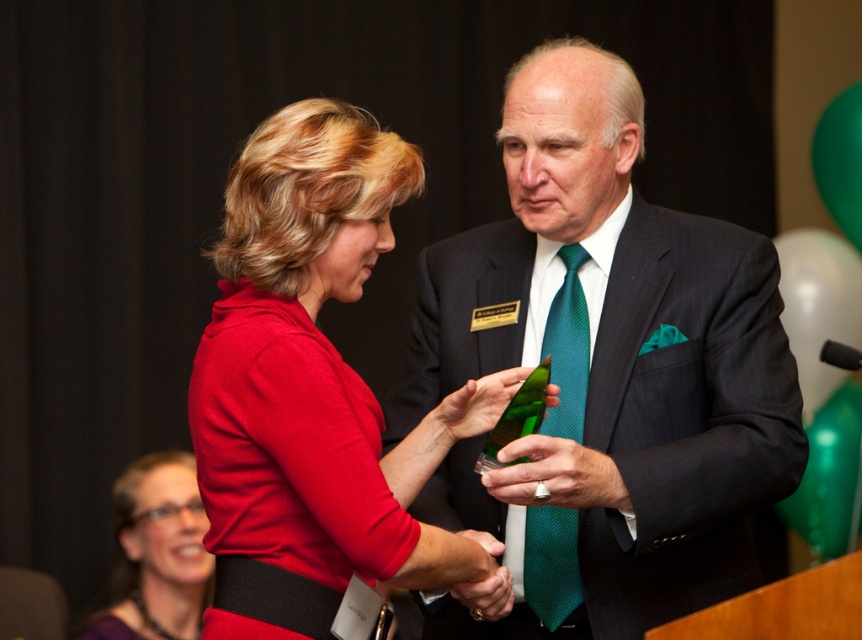
Question: Which of the following is the closest to the observer?

Choices:
 (A) (169, 536)
 (B) (557, 316)
 (C) (554, 378)
 (D) (248, 369)

Answer: (D)

Question: Can you confirm if matte red dress at center is bigger than purple fabric dress at lower left?

Choices:
 (A) no
 (B) yes

Answer: (B)

Question: Does matte red dress at center come behind purple fabric dress at lower left?

Choices:
 (A) no
 (B) yes

Answer: (A)

Question: Among these points, which one is farthest from the camera?

Choices:
 (A) (255, 324)
 (B) (191, 508)
 (C) (559, 291)
 (D) (619, 125)

Answer: (B)

Question: Where is matte red dress at center located in relation to green silk tie at center in the image?

Choices:
 (A) below
 (B) above

Answer: (B)

Question: Which is nearer to the matte black suit at center?

Choices:
 (A) purple fabric dress at lower left
 (B) green silk tie at center

Answer: (B)